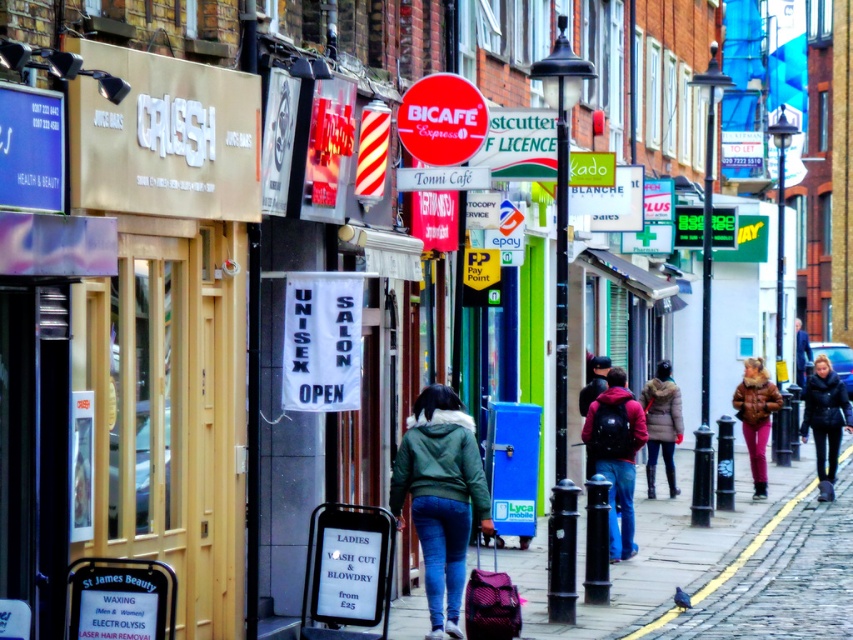
You are a delivery person trying to navigate through the narrow alley between the red plastic sign at center and the black leather jacket at right. The width of your delivery cart is 1.2 meters. Can you pass through the space between them?

The red plastic sign at center is narrower than the black leather jacket at right. However, the exact width of the space between them isn not provided in the description. Therefore, it is uncertain whether the 1.2 meter wide delivery cart can pass through.

You are standing in the middle of the street and see a red matte backpack at center and a dark brown fur coat at center. Which one is positioned to the left?

The red matte backpack at center is positioned to the left of the dark brown fur coat at center.

In the scene shown: You are a delivery person trying to navigate through the street. You see a red plastic sign at center and a black leather jacket at right. Which object takes up more space in the scene?

The black leather jacket at right takes up more space in the scene than the red plastic sign at center because the red plastic sign at center occupies less space than black leather jacket at right.